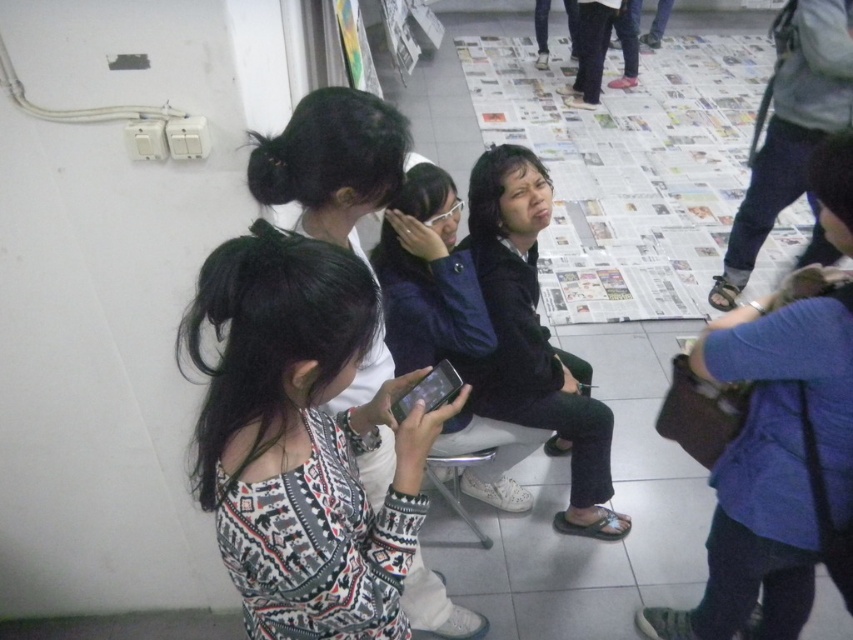
Question: Which is farther from the dark blue fabric jacket at center?

Choices:
 (A) patterned sweater at center
 (B) matte black phone at center

Answer: (B)

Question: In this image, where is dark blue fabric jacket at center located relative to matte black phone at center?

Choices:
 (A) above
 (B) below

Answer: (A)

Question: Does dark blue fabric jacket at center appear on the right side of patterned sweater at center?

Choices:
 (A) no
 (B) yes

Answer: (B)

Question: Is dark blue fabric jacket at center below matte black phone at center?

Choices:
 (A) yes
 (B) no

Answer: (B)

Question: Which object is closer to the camera taking this photo?

Choices:
 (A) patterned sweater at center
 (B) matte black phone at center
 (C) dark blue fabric jacket at center

Answer: (A)

Question: Which of the following is the farthest from the observer?

Choices:
 (A) (543, 164)
 (B) (334, 397)

Answer: (A)